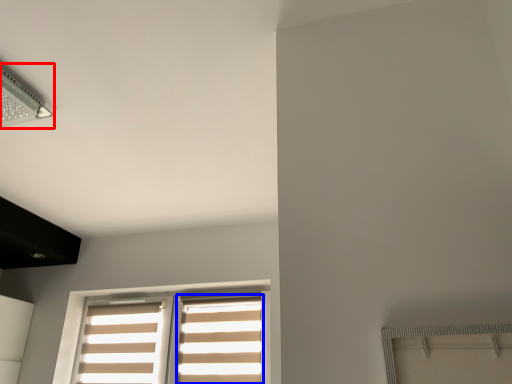
Question: Among these objects, which one is nearest to the camera, lamp (highlighted by a red box) or curtain (highlighted by a blue box)?

Choices:
 (A) lamp
 (B) curtain

Answer: (A)